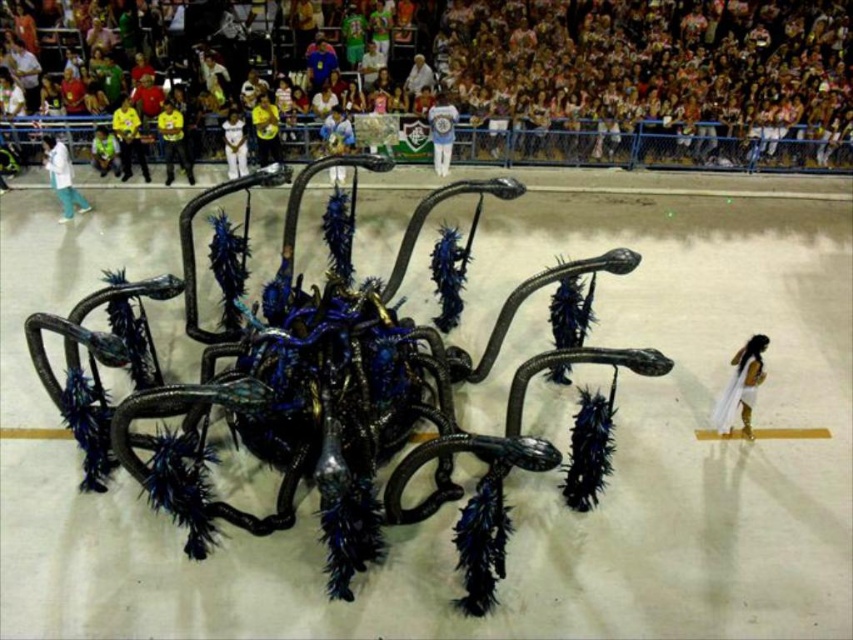
You are a photographer at the carnival and want to capture the float and the crowd. You notice two items in the foreground that might obstruct your view. Which item is shorter and less likely to block the camera lens? Please choose between the white silk dress at lower right and the yellow fabric at center.

The white silk dress at lower right is shorter than the yellow fabric at center, so it is less likely to block the camera lens.

You are a photographer at the carnival trying to capture the crowd. You notice two pairs of pants in the crowd. The white matte pants at left and the white fabric pants at center. Which pair of pants is closer to the front of the crowd?

The white matte pants at left is closer to the viewer than the white fabric pants at center, so the white matte pants at left is closer to the front of the crowd.

You are standing in the carnival crowd watching the spider float. You notice two points marked on the float. The first point is at coordinate (65, 189) and the second is at (440, 147). Which point is closer to you?

Point (65, 189) is closer to the camera than point (440, 147).